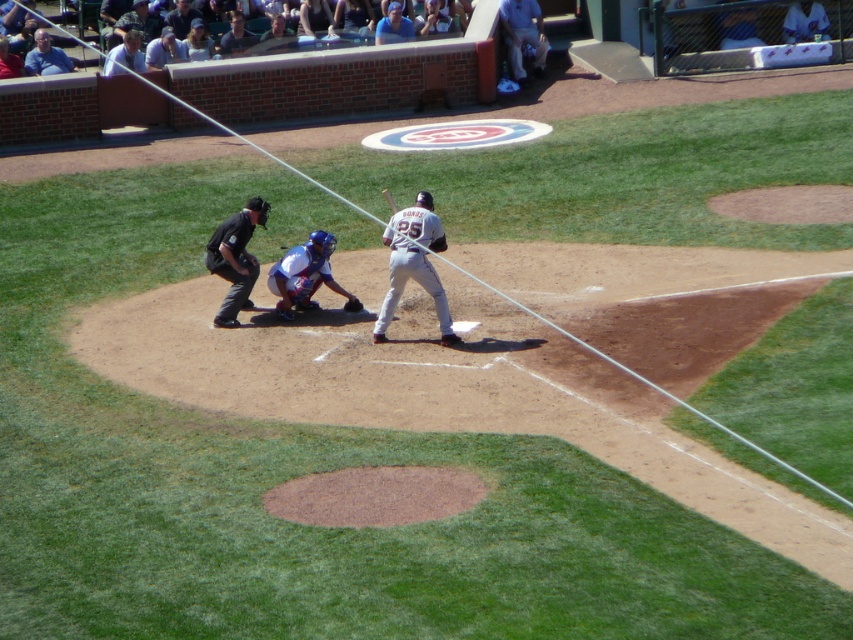
Question: Can you confirm if brown leather glove at center is bigger than wooden baseball bat at center?

Choices:
 (A) yes
 (B) no

Answer: (A)

Question: Among these objects, which one is nearest to the camera?

Choices:
 (A) camouflage fabric hat at upper left
 (B) blue fabric shirt at upper center
 (C) brown leather glove at center
 (D) light blue jeans at upper center

Answer: (C)

Question: Which point is farther from the camera taking this photo?

Choices:
 (A) (431, 234)
 (B) (357, 307)
 (C) (45, 61)

Answer: (C)

Question: Does blue matte catcher at center come behind light brown leather jacket at upper center?

Choices:
 (A) no
 (B) yes

Answer: (A)

Question: Is blue shirt at upper left thinner than dark blue uniform at upper center?

Choices:
 (A) yes
 (B) no

Answer: (B)

Question: Based on their relative distances, which object is nearer to the light blue shirt at upper left?

Choices:
 (A) light brown leather jacket at upper center
 (B) dark blue uniform at upper center
 (C) blue matte catcher at center

Answer: (A)